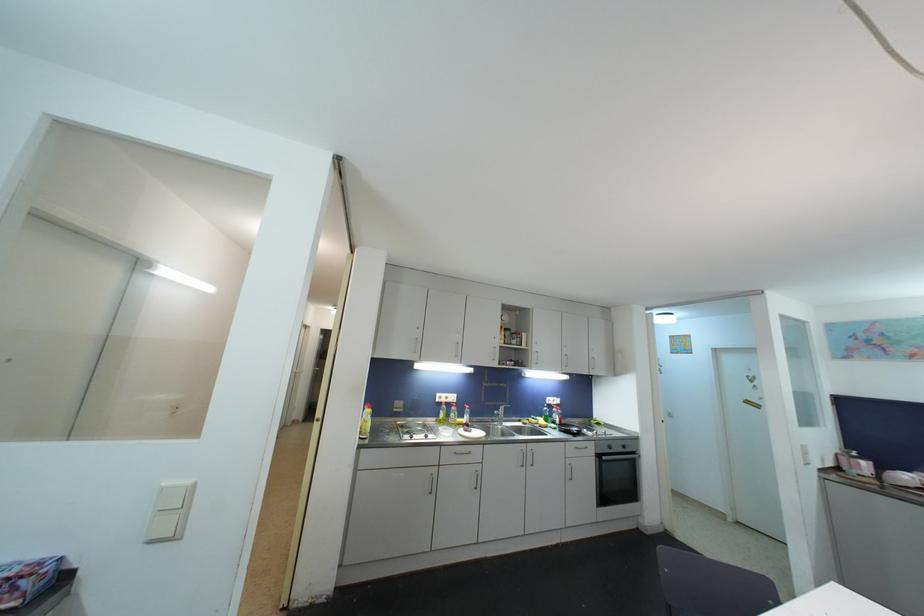
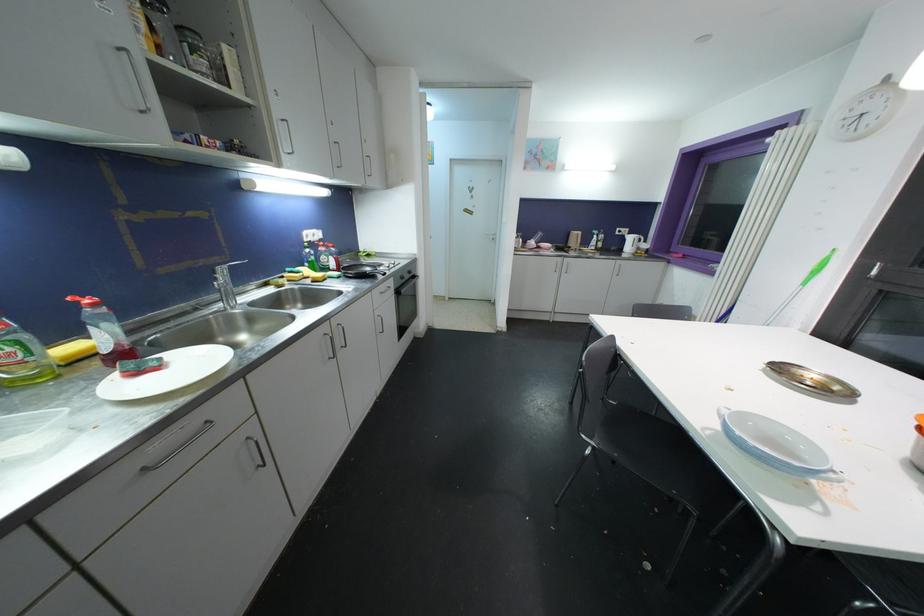
Find the pixel in the second image that matches [626,448] in the first image.

(412, 275)